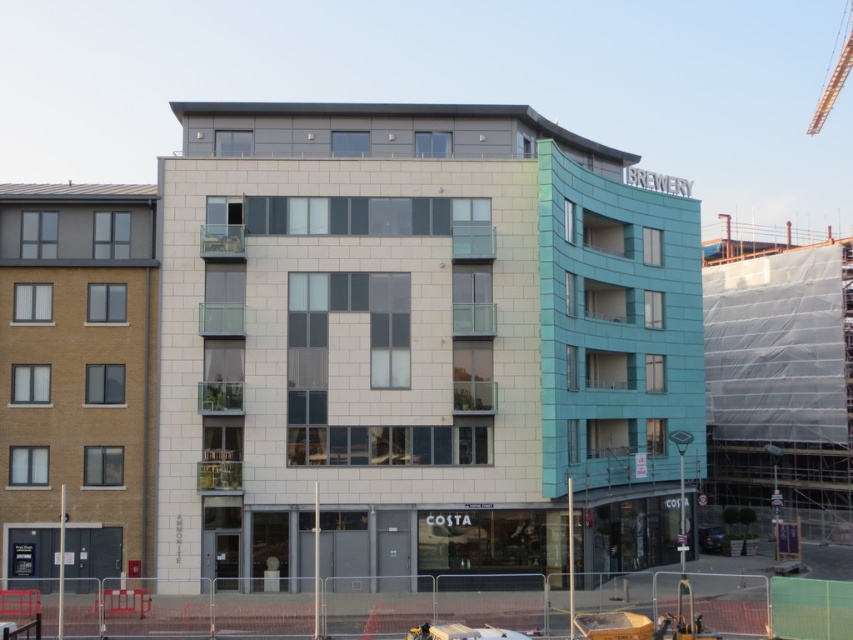
In the scene shown: You are an architect reviewing the building plans. The white textured building at center needs to be expanded upward to match the height of the metallic red crane at upper right. Is this possible without exceeding the city zoning laws, which allow buildings to be up to 10 meters taller than existing structures?

The white textured building at center is shorter than the metallic red crane at upper right. Since zoning laws permit buildings to be up to 10 meters taller than existing structures, expanding the white textured building at center to match the height of the metallic red crane at upper right would depend on whether the crane is within the allowable height difference. If the crane is no more than 10 meters taller, then it is possible. However, if the crane exceeds this height, the expansion would violate the

You are standing in front of the modern multi story building. You want to take a photo of the white textured building at center and the metallic red crane at upper right. Which object should you focus on first to ensure both are in frame?

You should focus on the white textured building at center first since it is closer to you than the metallic red crane at upper right, ensuring both are in frame by adjusting the camera angle accordingly.